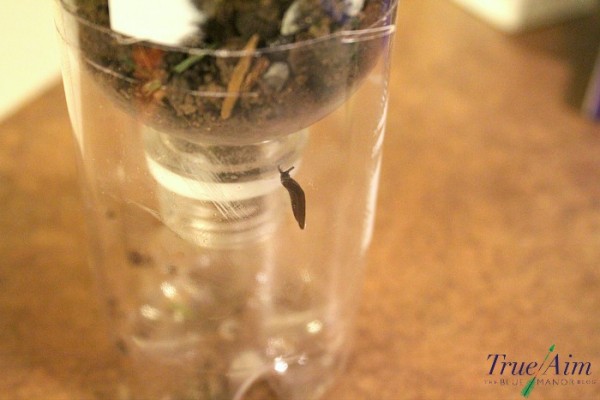
Where is `lightbulb bottom threading`? The width and height of the screenshot is (600, 400). lightbulb bottom threading is located at coordinates (236, 241), (236, 220), (238, 204).